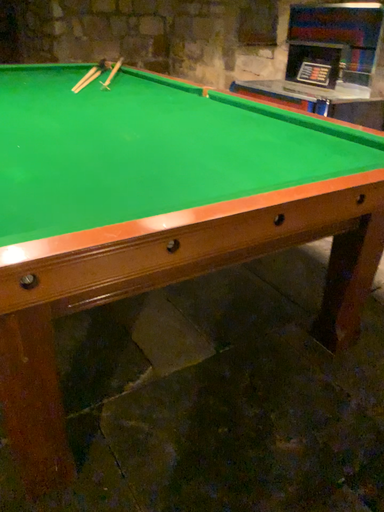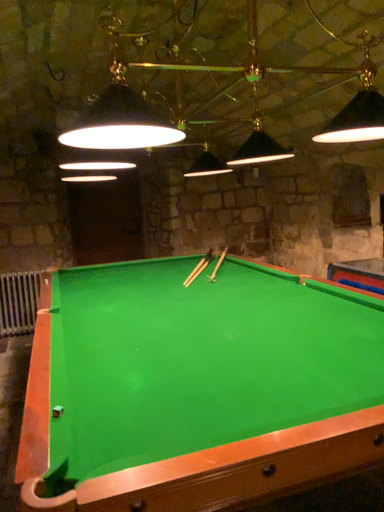
Question: Which way did the camera rotate in the video?

Choices:
 (A) rotated left
 (B) rotated right

Answer: (A)